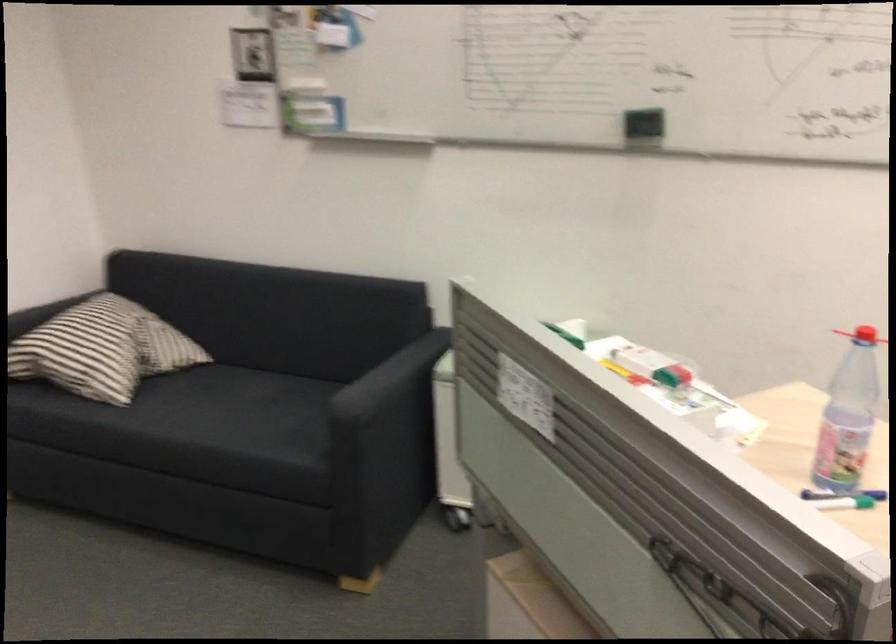
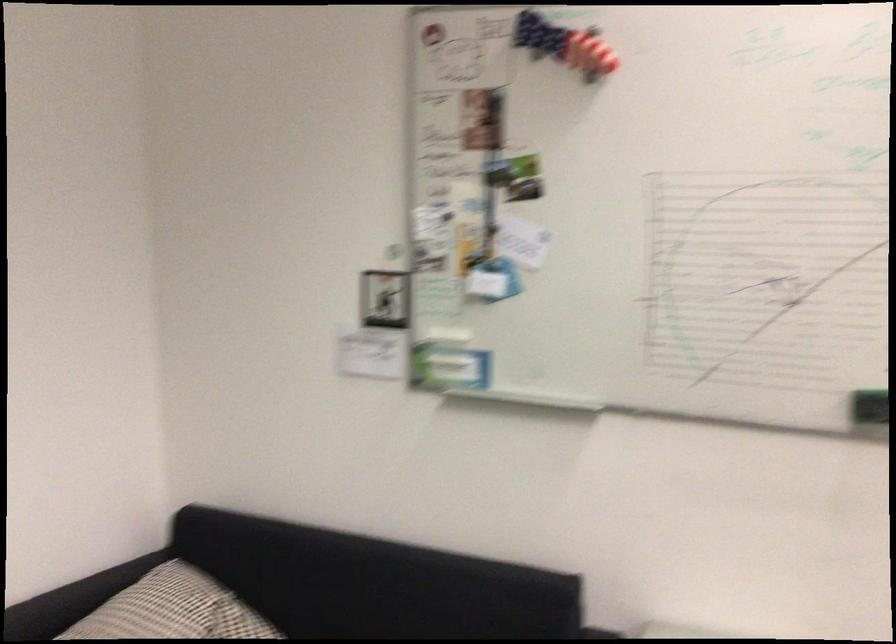
Find the pixel in the second image that matches (x=634, y=118) in the first image.

(869, 406)